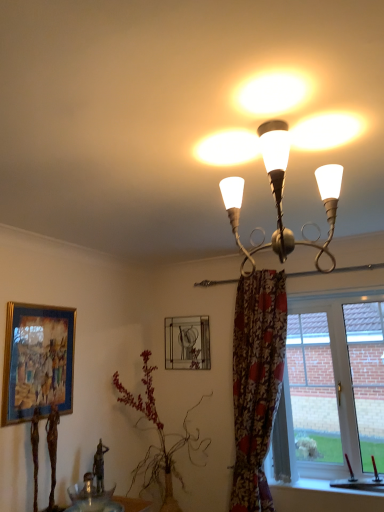
In order to face clear glass window at lower right, should I rotate leftwards or rightwards?

To align with it, rotate right about 18.029°.

Measure the distance between clear glass window at lower right and camera.

A distance of 8.87 feet exists between clear glass window at lower right and camera.

The image size is (384, 512). Describe the element at coordinates (130, 504) in the screenshot. I see `translucent glass bowl at lower center` at that location.

What do you see at coordinates (92, 500) in the screenshot? I see `transparent glass bowl at lower left` at bounding box center [92, 500].

Image resolution: width=384 pixels, height=512 pixels. Describe the element at coordinates (256, 382) in the screenshot. I see `floral fabric curtain at right` at that location.

Where is `clear glass window at lower right`? This screenshot has width=384, height=512. clear glass window at lower right is located at coordinates (317, 390).

Is point (84, 511) behind point (290, 454)?

No, (84, 511) is closer to viewer.

Is translucent glass bowl at lower center at the right side of clear glass window at lower right?

In fact, translucent glass bowl at lower center is to the left of clear glass window at lower right.

Is translucent glass bowl at lower center not near clear glass window at lower right?

translucent glass bowl at lower center is positioned a significant distance from clear glass window at lower right.

Is metallic chandelier at upper center not close to translucent glass bowl at lower center?

Absolutely, metallic chandelier at upper center is distant from translucent glass bowl at lower center.

From a real-world perspective, is metallic chandelier at upper center under translucent glass bowl at lower center?

No.

Is metallic chandelier at upper center not inside translucent glass bowl at lower center?

Absolutely, metallic chandelier at upper center is external to translucent glass bowl at lower center.

Is point (6, 422) behind point (101, 494)?

No, (6, 422) is closer to viewer.

Can you see gold-framed painting at left, the 1th picture frame viewed from the left, touching transparent glass bowl at lower left?

No.

Looking at this image, does gold-framed painting at left, the 1th picture frame viewed from the left, lie behind transparent glass bowl at lower left?

Yes, gold-framed painting at left, the 1th picture frame viewed from the left, is further from the camera.

Can you confirm if gold-framed painting at left, placed as the second picture frame when sorted from back to front, is positioned to the right of transparent glass bowl at lower left?

No.

In the scene shown: Is translucent glass bowl at lower center facing away from transparent glass bowl at lower left?

Yes, translucent glass bowl at lower center is positioned with its back facing transparent glass bowl at lower left.

Which is more to the left, translucent glass bowl at lower center or transparent glass bowl at lower left?

transparent glass bowl at lower left is more to the left.

Is point (98, 509) more distant than point (72, 501)?

Yes, it is behind point (72, 501).

Can you tell me how much translucent glass bowl at lower center and transparent glass bowl at lower left differ in facing direction?

The facing directions of translucent glass bowl at lower center and transparent glass bowl at lower left are 1.02 degrees apart.

Measure the distance between green leafy plant at center and clear glass window at lower right.

A distance of 33.34 inches exists between green leafy plant at center and clear glass window at lower right.

The image size is (384, 512). In order to click on plant in front of the clear glass window at lower right in this screenshot , I will do `click(159, 438)`.

Considering the relative positions of green leafy plant at center and clear glass window at lower right in the image provided, is green leafy plant at center to the right of clear glass window at lower right from the viewer's perspective?

No.

Is green leafy plant at center shorter than clear glass window at lower right?

Yes.

Is metallic silver picture frame at upper center, positioned as the 2th picture frame in left-to-right order, at the right side of metallic chandelier at upper center?

In fact, metallic silver picture frame at upper center, positioned as the 2th picture frame in left-to-right order, is to the left of metallic chandelier at upper center.

Which is behind, point (189, 344) or point (271, 246)?

The point (189, 344) is farther.

Is metallic silver picture frame at upper center, the first picture frame from the right, positioned in front of metallic chandelier at upper center?

No, metallic silver picture frame at upper center, the first picture frame from the right, is behind metallic chandelier at upper center.

Is metallic silver picture frame at upper center, positioned as the 2th picture frame in left-to-right order, positioned far away from metallic chandelier at upper center?

Yes, metallic silver picture frame at upper center, positioned as the 2th picture frame in left-to-right order, and metallic chandelier at upper center are quite far apart.

Looking at this image, in terms of height, does transparent glass bowl at lower left look taller or shorter compared to clear glass window at lower right?

transparent glass bowl at lower left is shorter than clear glass window at lower right.

Between transparent glass bowl at lower left and clear glass window at lower right, which one is positioned behind?

clear glass window at lower right is behind.

From the image's perspective, would you say transparent glass bowl at lower left is positioned over clear glass window at lower right?

No.

In order to click on table below the clear glass window at lower right (from a real-world perspective) in this screenshot , I will do `click(130, 504)`.

Locate an element on the screen. The image size is (384, 512). table on the left of metallic chandelier at upper center is located at coordinates (130, 504).

When comparing their distances from floral fabric curtain at right, does green leafy plant at center or gold-framed painting at left, placed as the second picture frame when sorted from back to front, seem further?

gold-framed painting at left, placed as the second picture frame when sorted from back to front, is positioned further to the anchor floral fabric curtain at right.

When comparing their distances from transparent glass bowl at lower left, does metallic silver picture frame at upper center, which is counted as the 1th picture frame, starting from the back, or clear glass window at lower right seem further?

clear glass window at lower right is positioned further to the anchor transparent glass bowl at lower left.

Based on their spatial positions, is gold-framed painting at left, which is counted as the 1th picture frame, starting from the front, or metallic silver picture frame at upper center, the first picture frame from the right, closer to translucent glass bowl at lower center?

gold-framed painting at left, which is counted as the 1th picture frame, starting from the front, is positioned closer to the anchor translucent glass bowl at lower center.

Considering their positions, is green leafy plant at center positioned closer to translucent glass bowl at lower center than floral fabric curtain at right?

Based on the image, green leafy plant at center appears to be nearer to translucent glass bowl at lower center.

Based on their spatial positions, is translucent glass bowl at lower center or gold-framed painting at left, which is counted as the 2th picture frame, starting from the right, further from floral fabric curtain at right?

Based on the image, gold-framed painting at left, which is counted as the 2th picture frame, starting from the right, appears to be further to floral fabric curtain at right.

From the picture: Considering their positions, is floral fabric curtain at right positioned further to metallic chandelier at upper center than clear glass window at lower right?

clear glass window at lower right.

Consider the image. Which object lies further to the anchor point metallic silver picture frame at upper center, positioned as the 2th picture frame in left-to-right order, translucent glass bowl at lower center or floral fabric curtain at right?

translucent glass bowl at lower center.

Considering their positions, is metallic silver picture frame at upper center, the first picture frame from the right, positioned closer to floral fabric curtain at right than green leafy plant at center?

Among the two, green leafy plant at center is located nearer to floral fabric curtain at right.

Where is `plant between metallic chandelier at upper center and clear glass window at lower right from front to back`? The height and width of the screenshot is (512, 384). plant between metallic chandelier at upper center and clear glass window at lower right from front to back is located at coordinates (159, 438).

Image resolution: width=384 pixels, height=512 pixels. I want to click on window positioned between metallic chandelier at upper center and metallic silver picture frame at upper center, the first picture frame from the right, from near to far, so click(317, 390).

What are the coordinates of `table located between metallic chandelier at upper center and metallic silver picture frame at upper center, positioned as the 2th picture frame in left-to-right order, in the depth direction` in the screenshot? It's located at (130, 504).

This screenshot has height=512, width=384. I want to click on lamp situated between gold-framed painting at left, which is counted as the 2th picture frame, starting from the right, and clear glass window at lower right from left to right, so click(282, 194).